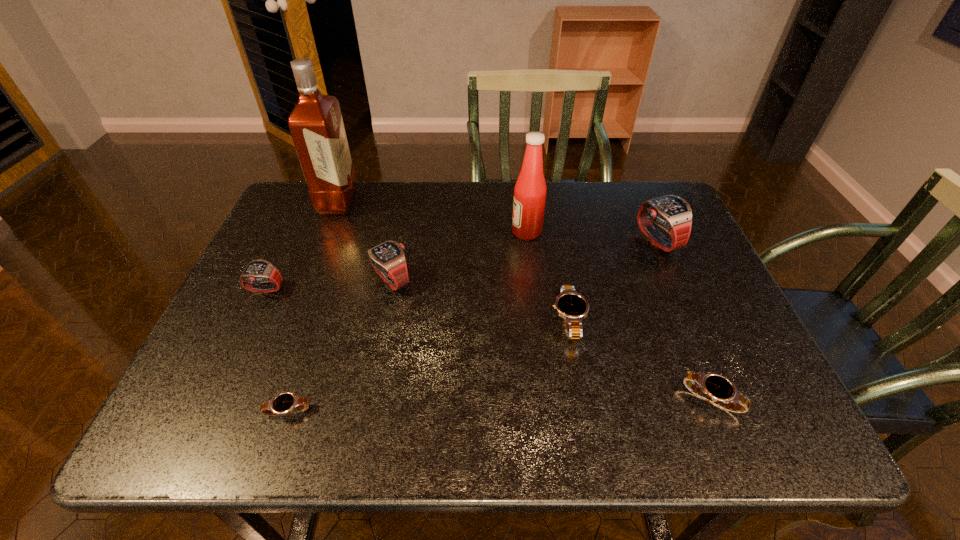
At what (x,y) coordinates should I click in order to perform the action: click on vacant space that satisfies the following two spatial constraints: 1. on the back side of the biggest black watch; 2. on the front-facing side of the red condiment. Please return your answer as a coordinate pair (x, y). This screenshot has height=540, width=960. Looking at the image, I should click on (552, 232).

Find the location of a particular element. Image resolution: width=960 pixels, height=540 pixels. free spot that satisfies the following two spatial constraints: 1. on the back side of the smallest red watch; 2. on the right side of the biggest red watch is located at coordinates [x=289, y=241].

The height and width of the screenshot is (540, 960). I want to click on vacant area that satisfies the following two spatial constraints: 1. on the back side of the second watch from left to right; 2. on the right side of the fifth object from right to left, so click(x=332, y=280).

Locate an element on the screen. This screenshot has width=960, height=540. vacant space that satisfies the following two spatial constraints: 1. on the back side of the seventh tallest object; 2. on the front-facing side of the second tallest object is located at coordinates (643, 232).

Find the location of a particular element. free region that satisfies the following two spatial constraints: 1. on the front label of the liquor; 2. on the left side of the shortest object is located at coordinates (257, 410).